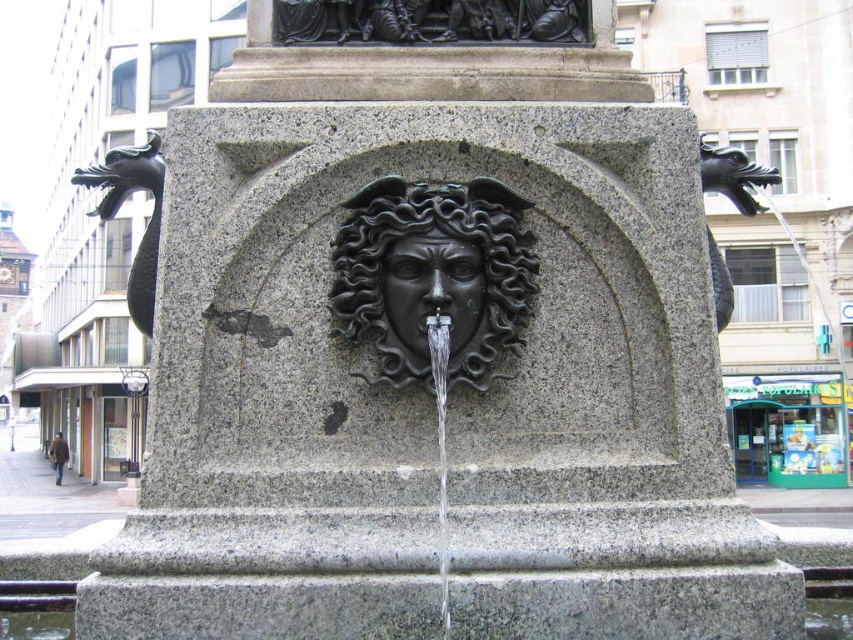
You are standing in front of the fountain and want to touch the black polished stone lion at center and the black polished stone face at center. Which one can you reach without moving your hand further away from your body?

The black polished stone lion at center is closer to the viewer than the black polished stone face at center, so you can reach it without moving your hand further away.

You are standing in front of the fountain and want to place a small flower pot on the highest point between the black polished stone lion at center and the black polished stone face at center. Which object should you choose?

The black polished stone lion at center has a greater height compared to the black polished stone face at center, so you should place the flower pot on the black polished stone lion at center.